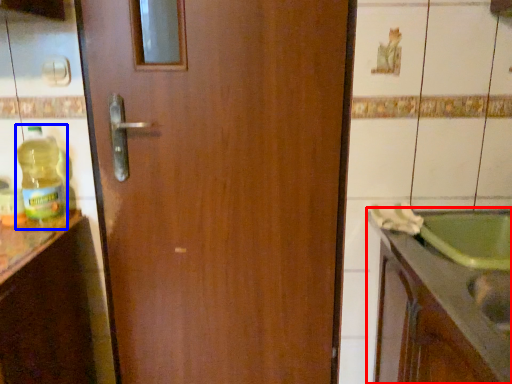
Question: Which point is closer to the camera, countertop (highlighted by a red box) or bottle (highlighted by a blue box)?

Choices:
 (A) countertop
 (B) bottle

Answer: (A)